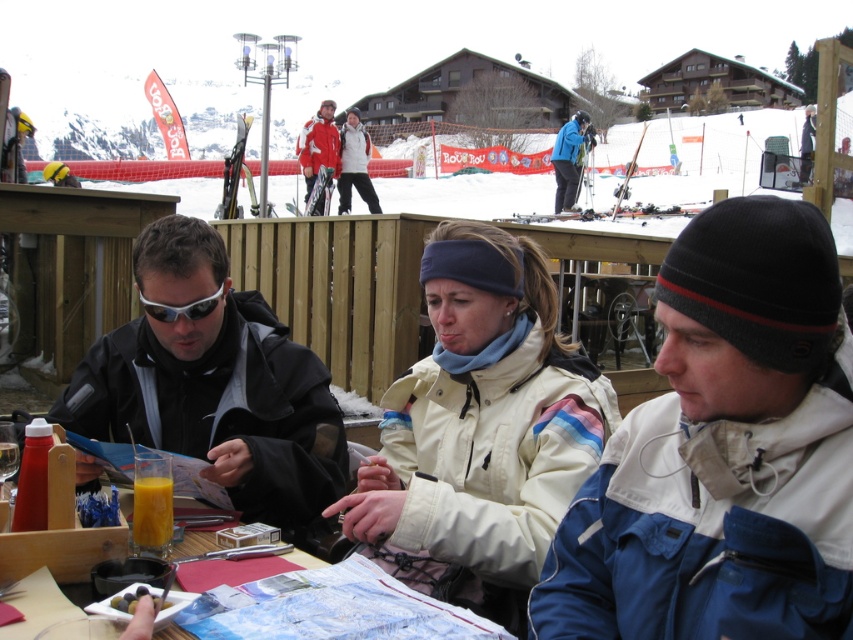
You are standing at the table in the scene and want to place a new menu. The menu should be placed near the point labeled as point (723,449). Which object at the table is closest to this point?

The point (723,449) is on the blue and white jacket at center, so the closest object to this point would be the blue and white jacket at center.

You are a photographer standing at the edge of the ski resort, looking at the orange translucent glass at lower left and the blue matte jacket at center. Which object is positioned more to the left side of the scene?

The orange translucent glass at lower left is positioned more to the left side of the scene than the blue matte jacket at center.